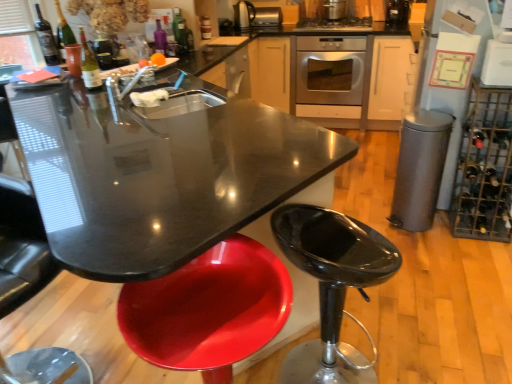
At what (x,y) coordinates should I click in order to perform the action: click on vacant point above glossy black countertop at center (from a real-world perspective). Please return your answer as a coordinate pair (x, y). Looking at the image, I should click on (198, 165).